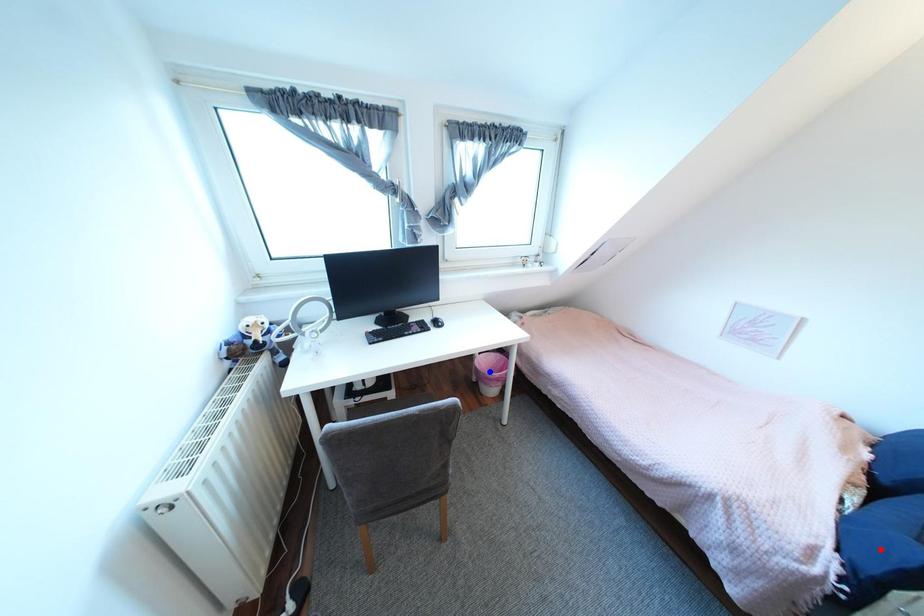
Question: Which of the two points in the image is closer to the camera?

Choices:
 (A) Blue point is closer.
 (B) Red point is closer.

Answer: (B)